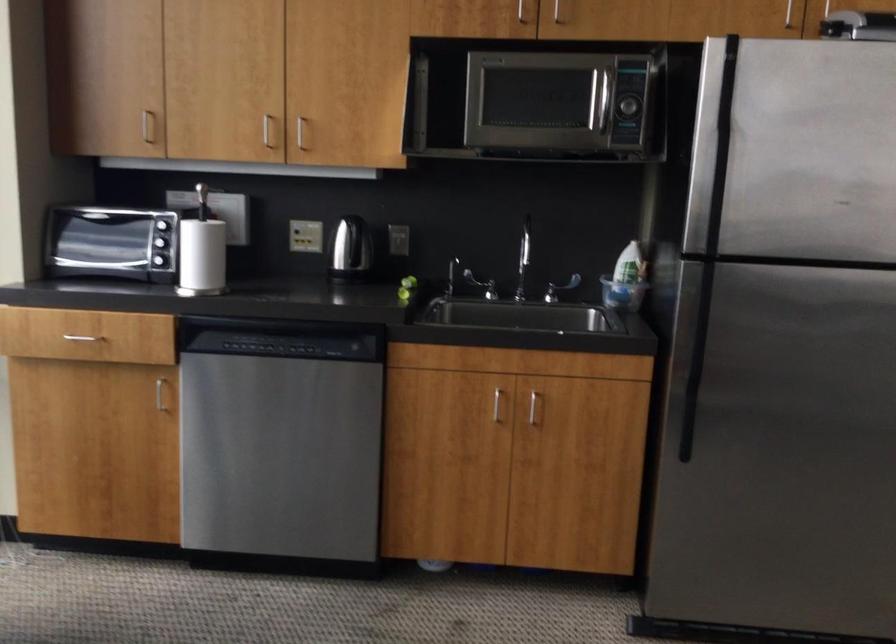
The width and height of the screenshot is (896, 644). What do you see at coordinates (718, 184) in the screenshot? I see `the long refrigerator handle` at bounding box center [718, 184].